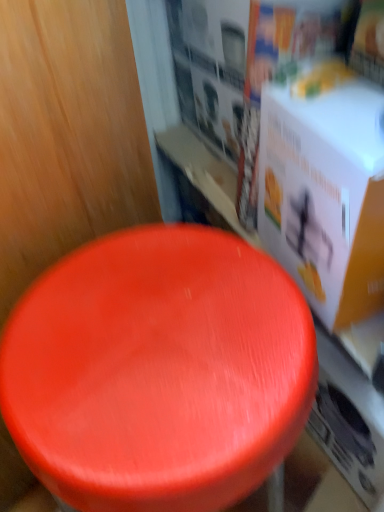
Question: Considering the positions of shiny red stool at center and white cardboard box at upper right in the image, is shiny red stool at center bigger or smaller than white cardboard box at upper right?

Choices:
 (A) big
 (B) small

Answer: (A)

Question: Do you think shiny red stool at center is within white cardboard box at upper right, or outside of it?

Choices:
 (A) outside
 (B) inside

Answer: (A)

Question: Visually, is shiny red stool at center positioned to the left or to the right of white cardboard box at upper right?

Choices:
 (A) left
 (B) right

Answer: (A)

Question: Is white cardboard box at upper right bigger or smaller than shiny red stool at center?

Choices:
 (A) big
 (B) small

Answer: (B)

Question: From a real-world perspective, is white cardboard box at upper right physically located above or below shiny red stool at center?

Choices:
 (A) above
 (B) below

Answer: (A)

Question: Is white cardboard box at upper right to the left or to the right of shiny red stool at center in the image?

Choices:
 (A) left
 (B) right

Answer: (B)

Question: Considering the positions of point pyautogui.click(x=329, y=326) and point pyautogui.click(x=152, y=256), is point pyautogui.click(x=329, y=326) closer or farther from the camera than point pyautogui.click(x=152, y=256)?

Choices:
 (A) closer
 (B) farther

Answer: (A)